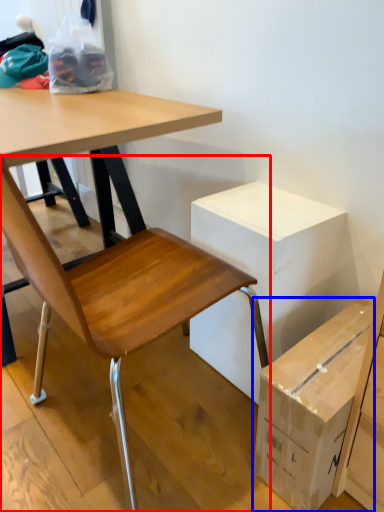
Question: Among these objects, which one is nearest to the camera, chair (highlighted by a red box) or box (highlighted by a blue box)?

Choices:
 (A) chair
 (B) box

Answer: (A)